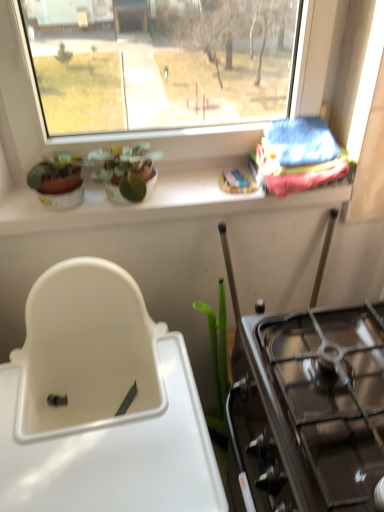
Question: Considering the relative positions of blue fabric at upper right and black glass gas stove at right in the image provided, is blue fabric at upper right behind black glass gas stove at right?

Choices:
 (A) yes
 (B) no

Answer: (A)

Question: From the image's perspective, is blue fabric at upper right under black glass gas stove at right?

Choices:
 (A) yes
 (B) no

Answer: (B)

Question: From a real-world perspective, is blue fabric at upper right on black glass gas stove at right?

Choices:
 (A) yes
 (B) no

Answer: (A)

Question: Can you confirm if blue fabric at upper right is wider than black glass gas stove at right?

Choices:
 (A) no
 (B) yes

Answer: (A)

Question: Could you tell me if blue fabric at upper right is facing black glass gas stove at right?

Choices:
 (A) yes
 (B) no

Answer: (A)

Question: From a real-world perspective, is blue fabric at upper right physically below black glass gas stove at right?

Choices:
 (A) no
 (B) yes

Answer: (A)

Question: Considering the relative sizes of white plastic sink at lower left and matte ceramic plant at upper center in the image provided, is white plastic sink at lower left thinner than matte ceramic plant at upper center?

Choices:
 (A) no
 (B) yes

Answer: (A)

Question: From the image's perspective, is white plastic sink at lower left located beneath matte ceramic plant at upper center?

Choices:
 (A) yes
 (B) no

Answer: (A)

Question: Is white plastic sink at lower left positioned in front of matte ceramic plant at upper center?

Choices:
 (A) yes
 (B) no

Answer: (A)

Question: Is white plastic sink at lower left taller than matte ceramic plant at upper center?

Choices:
 (A) no
 (B) yes

Answer: (B)

Question: Can you confirm if white plastic sink at lower left is positioned to the right of matte ceramic plant at upper center?

Choices:
 (A) no
 (B) yes

Answer: (A)

Question: Could you tell me if white plastic sink at lower left is facing matte ceramic plant at upper center?

Choices:
 (A) no
 (B) yes

Answer: (A)

Question: Is black glass gas stove at right bigger than blue fabric at upper right?

Choices:
 (A) yes
 (B) no

Answer: (A)